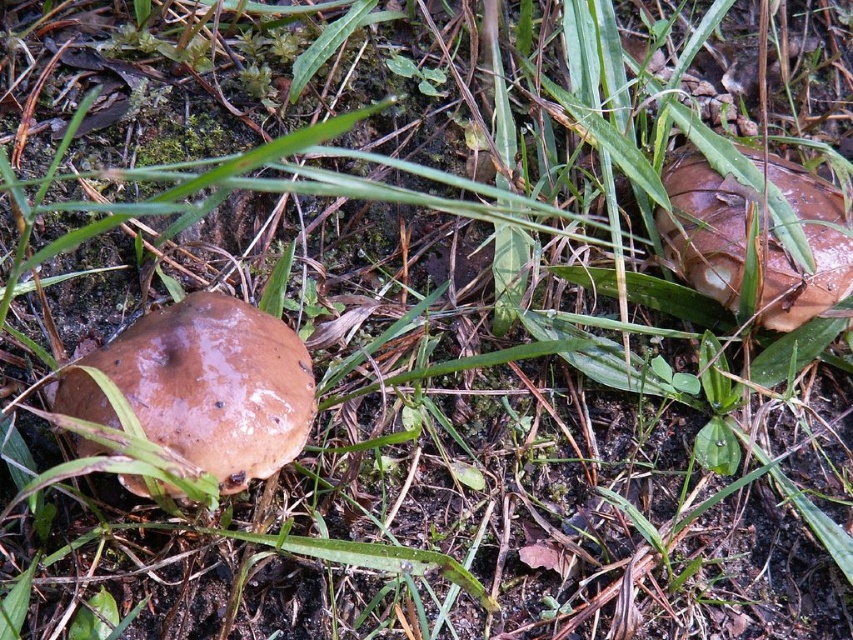
You are an outdoor photographer trying to capture both the brown matte mushroom at lower left and the brown matte mushroom at right in a single frame. Based on their positions, which mushroom is closer to the left edge of your camera view?

The brown matte mushroom at lower left is positioned to the left of the brown matte mushroom at right, so it is closer to the left edge of the camera view.

You are a mycologist examining a closeup of a natural ground scene with two mushrooms. You need to locate the brown matte mushroom at lower left. What are its coordinates?

The brown matte mushroom at lower left is located at coordinates point (215, 385).

You are a mycologist examining two brown matte mushrooms in a grassy area. You notice the brown matte mushroom at lower left and the brown matte mushroom at right. Which one is shorter in height?

The brown matte mushroom at lower left is shorter in height compared to the brown matte mushroom at right.